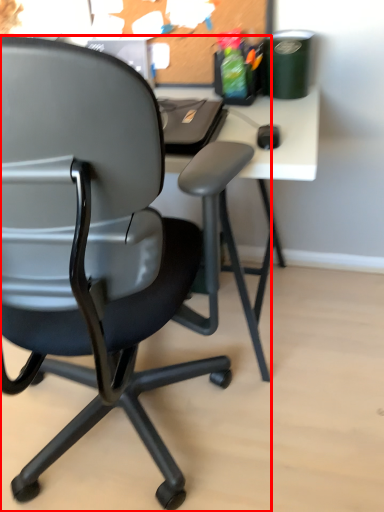
Question: From the image's perspective, what is the correct spatial positioning of chair (annotated by the red box) in reference to bulletin board?

Choices:
 (A) below
 (B) above

Answer: (A)